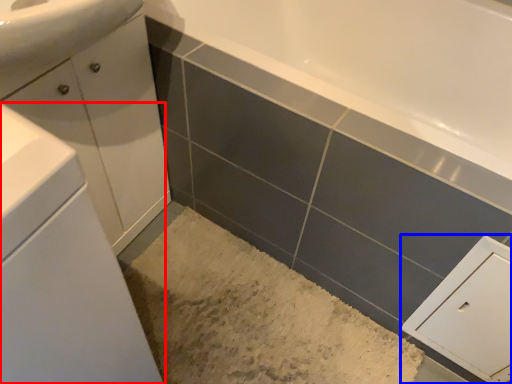
Question: Among these objects, which one is farthest to the camera, bathroom cabinet (highlighted by a red box) or cabinetry (highlighted by a blue box)?

Choices:
 (A) bathroom cabinet
 (B) cabinetry

Answer: (B)